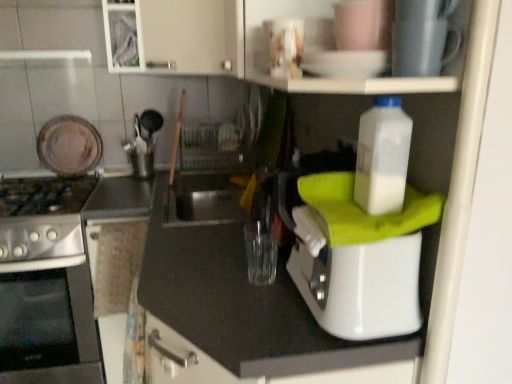
Where is `free space in front of matte brown plate at upper left, which is the 1th appliance from back to front`? This screenshot has height=384, width=512. free space in front of matte brown plate at upper left, which is the 1th appliance from back to front is located at coordinates coord(59,182).